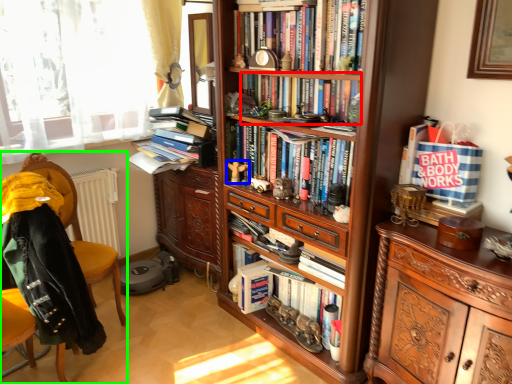
Question: Which is nearer to the book (highlighted by a red box)? toy (highlighted by a blue box) or chair (highlighted by a green box).

Choices:
 (A) toy
 (B) chair

Answer: (A)